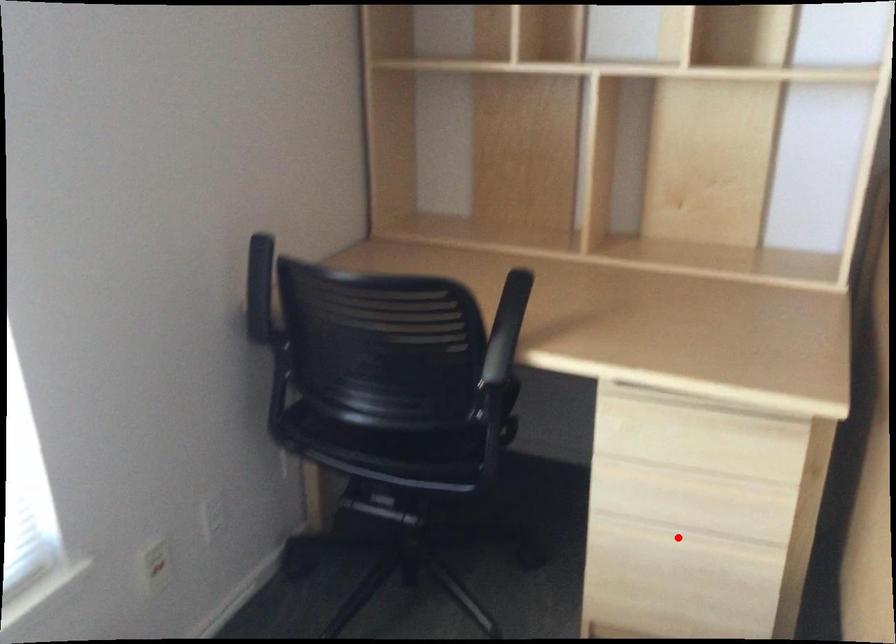
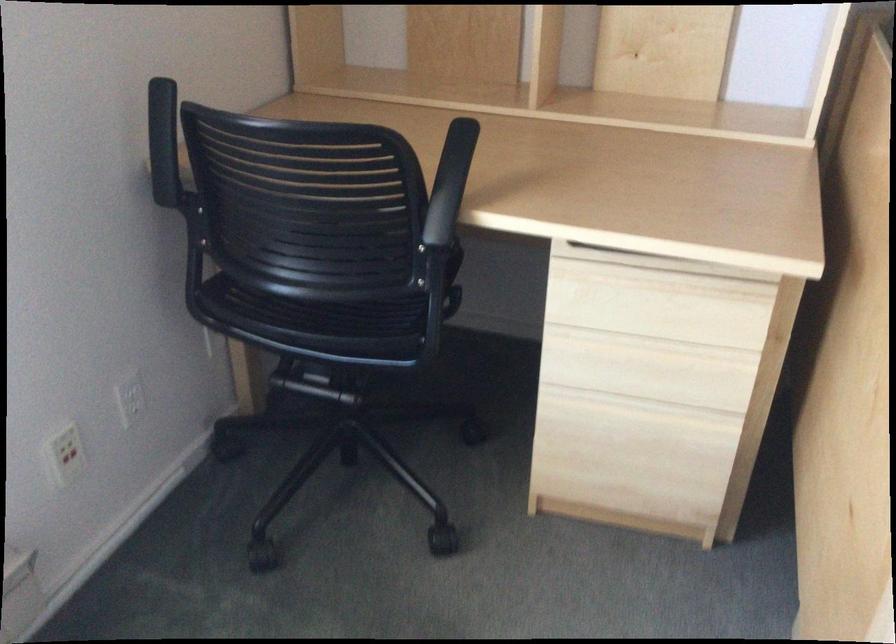
Locate, in the second image, the point that corresponds to the highlighted location in the first image.

(632, 409)